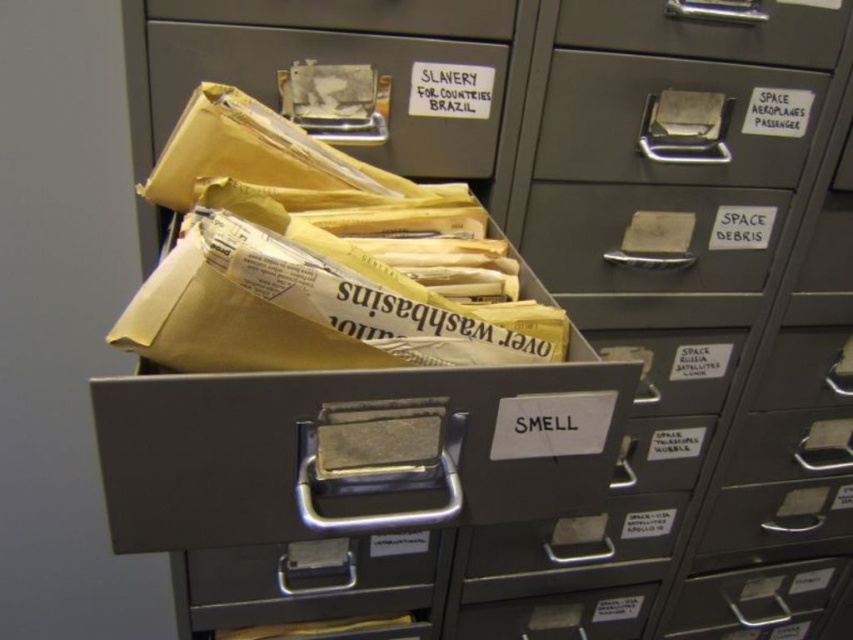
You need to store a large legal document that requires a drawer with enough space. Based on the scene, which drawer between the metallic gray drawer at center and the matte cardboard drawer at upper center should you choose?

The matte cardboard drawer at upper center is larger than the metallic gray drawer at center, so you should choose the matte cardboard drawer at upper center to store the large legal document.

You are standing in front of the filing cabinet and want to reach the point at coordinates point [172,44]. If your hand can extend 25 inches, will you be able to reach it?

The point [172,44] is 28.10 inches away from the viewer. Since your hand can only extend 25 inches, you will not be able to reach it.